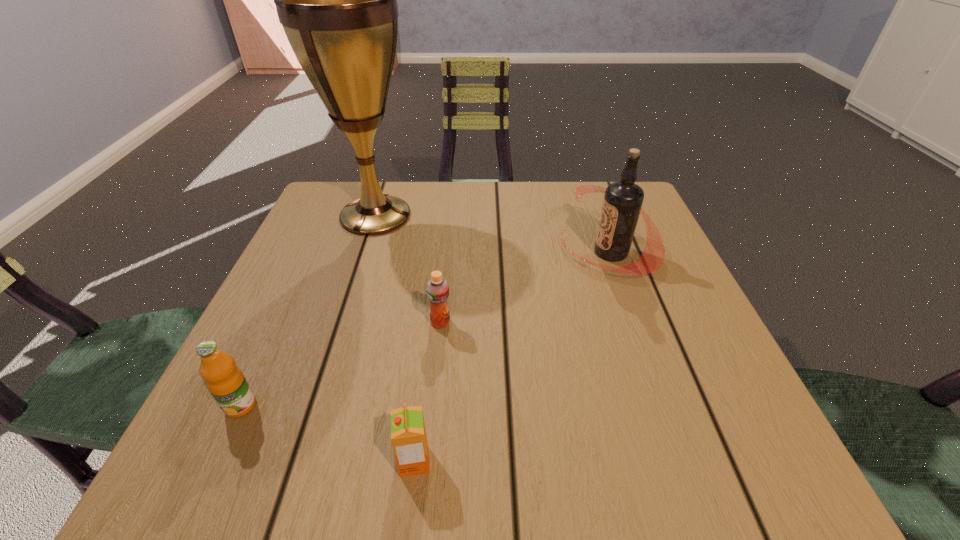
What are the coordinates of `the closest object to the second tallest object` in the screenshot? It's located at (437, 288).

Image resolution: width=960 pixels, height=540 pixels. Identify the location of the closest orange juice relative to the trophy cup. (437, 288).

Find the location of a particular element. orange juice object that ranks as the second closest to the root beer is located at coordinates (408, 435).

This screenshot has height=540, width=960. In order to click on free space that satisfies the following two spatial constraints: 1. on the label of the nearest object; 2. on the right side of the second farthest orange juice in this screenshot , I will do `click(215, 461)`.

Where is `vacant space that satisfies the following two spatial constraints: 1. on the front side of the farthest orange juice; 2. on the right side of the trophy cup`? This screenshot has width=960, height=540. vacant space that satisfies the following two spatial constraints: 1. on the front side of the farthest orange juice; 2. on the right side of the trophy cup is located at coordinates (341, 323).

This screenshot has width=960, height=540. Identify the location of vacant region that satisfies the following two spatial constraints: 1. on the front side of the third nearest object; 2. on the left side of the trophy cup. (341, 323).

The height and width of the screenshot is (540, 960). What are the coordinates of `free space that satisfies the following two spatial constraints: 1. on the back side of the nearest orange juice; 2. on the left side of the farthest orange juice` in the screenshot? It's located at (430, 323).

The width and height of the screenshot is (960, 540). In order to click on free space that satisfies the following two spatial constraints: 1. on the front side of the third nearest object; 2. on the left side of the tallest object in this screenshot , I will do `click(341, 323)`.

I want to click on vacant space that satisfies the following two spatial constraints: 1. on the label of the root beer; 2. on the label of the leftmost orange juice, so click(665, 406).